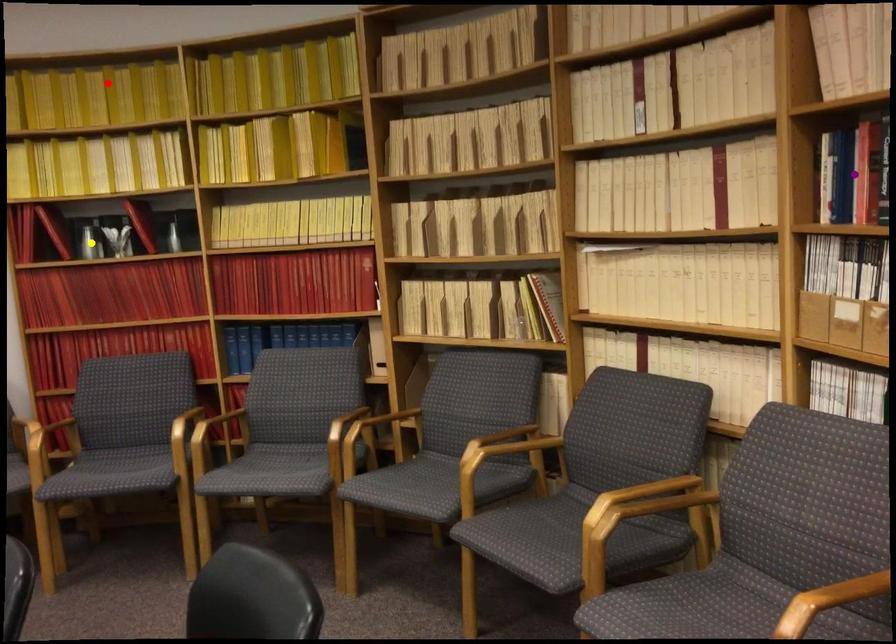
Order these from nearest to farthest:
A) purple point
B) yellow point
C) red point

purple point < red point < yellow point